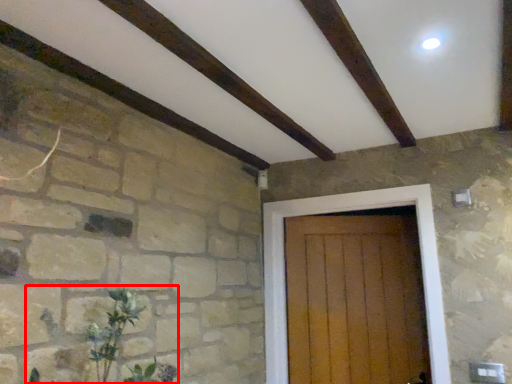
Question: Where is plant (annotated by the red box) located in relation to door in the image?

Choices:
 (A) left
 (B) right

Answer: (A)